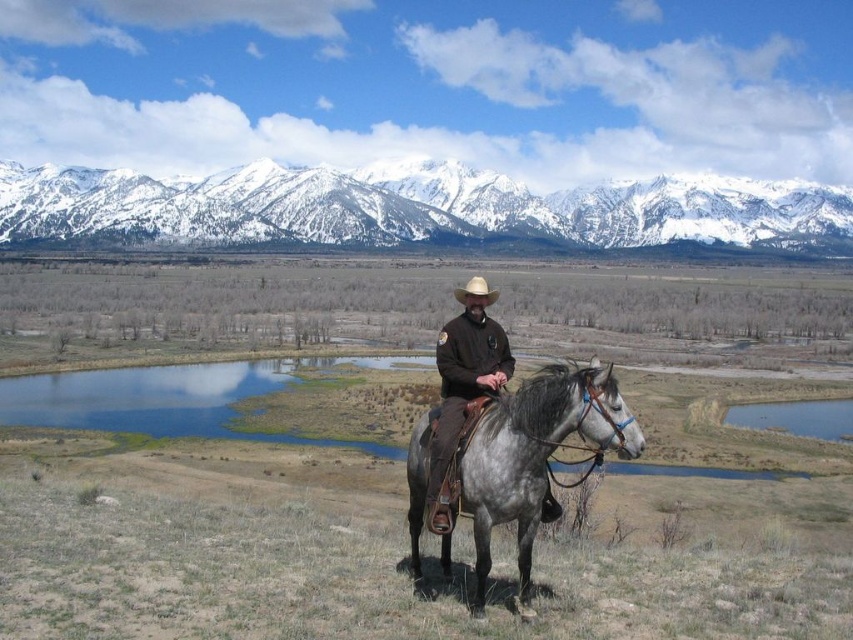
This screenshot has width=853, height=640. In order to click on snowy granite mountains at upper center in this screenshot , I will do `click(416, 208)`.

Identify the location of snowy granite mountains at upper center. (416, 208).

Where is `snowy granite mountains at upper center`? snowy granite mountains at upper center is located at coordinates (416, 208).

Is point (840, 196) closer to viewer compared to point (451, 435)?

No, it is behind (451, 435).

Does snowy granite mountains at upper center have a smaller size compared to brown leather jacket at center?

Actually, snowy granite mountains at upper center might be larger than brown leather jacket at center.

Which is in front, point (518, 186) or point (480, 340)?

Point (480, 340) is in front.

Find the location of a particular element. The width and height of the screenshot is (853, 640). snowy granite mountains at upper center is located at coordinates click(x=416, y=208).

Consider the image. Which is more to the left, gray leather horse at center or brown felt cowboy hat at center?

Positioned to the left is brown felt cowboy hat at center.

Who is more forward, (592, 433) or (491, 298)?

Point (592, 433) is in front.

You are a GUI agent. You are given a task and a screenshot of the screen. Output one action in this format:
    pyautogui.click(x=<x>, y=<y>)
    Task: Click on the gray leather horse at center
    The width and height of the screenshot is (853, 640).
    Given the screenshot: What is the action you would take?
    pyautogui.click(x=534, y=456)